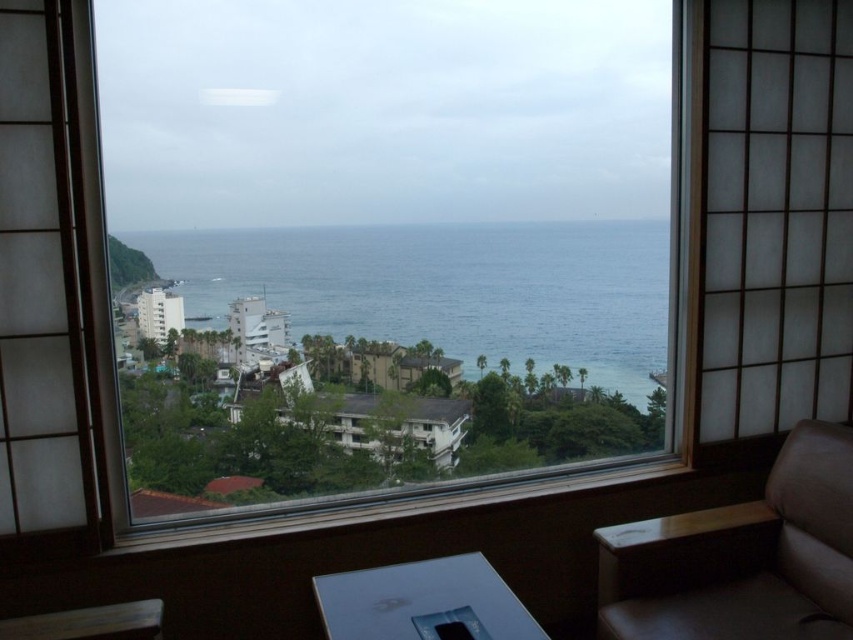
Question: Is wooden frame at center closer to camera compared to blue water at center?

Choices:
 (A) yes
 (B) no

Answer: (A)

Question: Can you confirm if wooden frame at center is thinner than blue water at center?

Choices:
 (A) yes
 (B) no

Answer: (B)

Question: Can you confirm if blue water at center is positioned to the left of brown leather couch at lower right?

Choices:
 (A) yes
 (B) no

Answer: (A)

Question: Which is farther from the blue water at center?

Choices:
 (A) brown leather couch at lower right
 (B) wooden frame at center

Answer: (A)

Question: Among these points, which one is farthest from the camera?

Choices:
 (A) (503, 264)
 (B) (126, 228)
 (C) (657, 566)

Answer: (A)

Question: Which point is closer to the camera?

Choices:
 (A) pos(538,259)
 (B) pos(618,65)
 (C) pos(733,538)

Answer: (C)